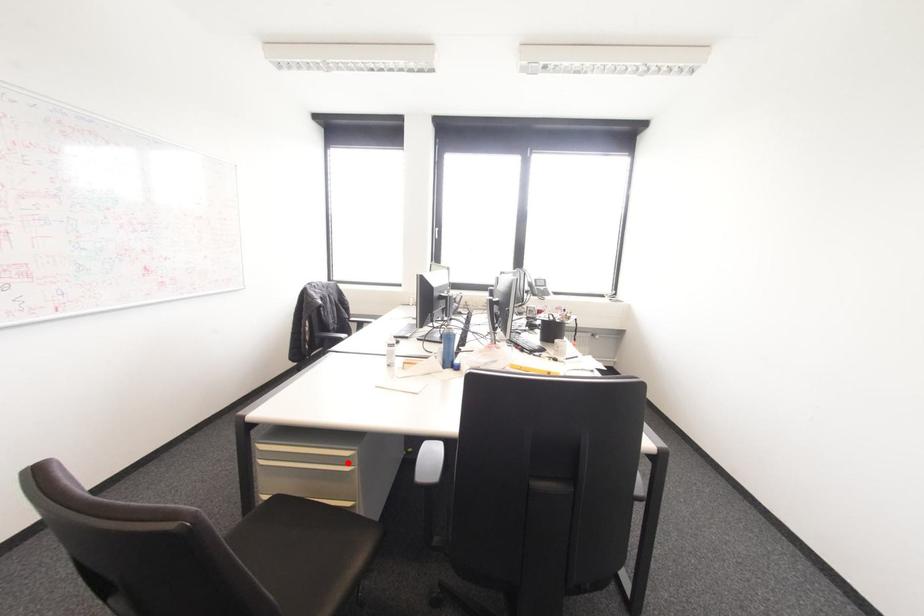
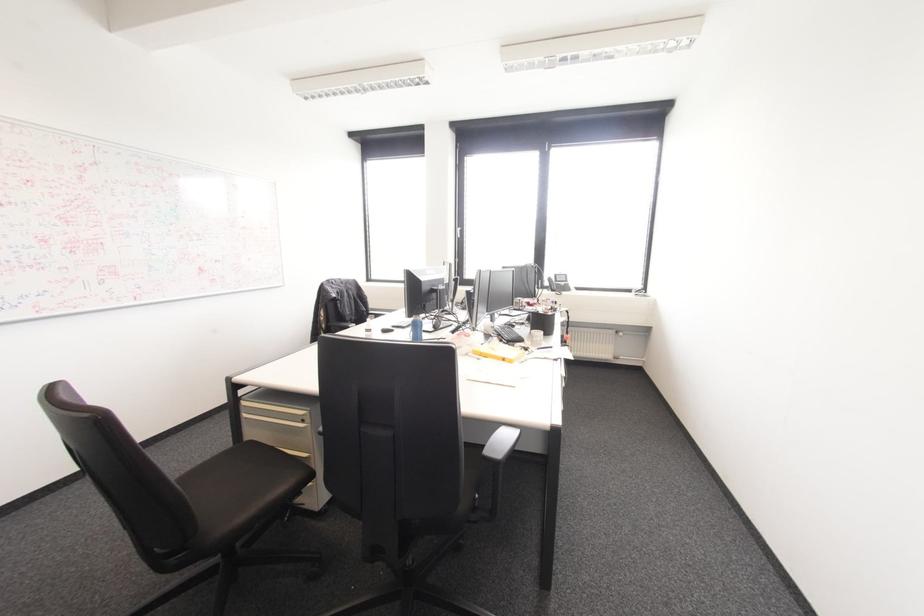
Question: I am providing you with two images of the same scene from different viewpoints. A red point is shown in image1. For the corresponding object point in image2, is it positioned nearer or farther from the camera?

Choices:
 (A) Nearer
 (B) Farther

Answer: (B)